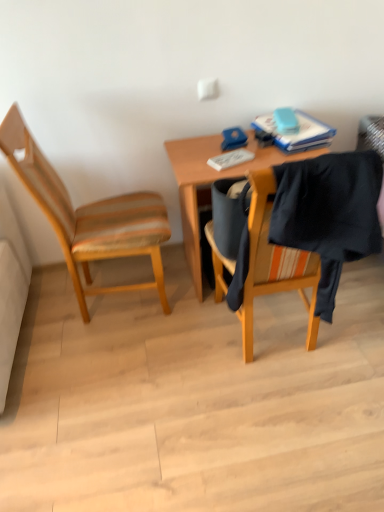
The height and width of the screenshot is (512, 384). What do you see at coordinates (211, 183) in the screenshot?
I see `wooden desk at center` at bounding box center [211, 183].

The height and width of the screenshot is (512, 384). In order to click on blue matte book at upper right in this screenshot , I will do `click(294, 134)`.

Where is `black fabric at right`? This screenshot has width=384, height=512. black fabric at right is located at coordinates (329, 214).

Find the location of a particular element. wooden desk at center is located at coordinates (211, 183).

Can you tell me how much blue matte book at upper right and wooden chair at left differ in facing direction?

The angular difference between blue matte book at upper right and wooden chair at left is 79.7 degrees.

In the scene shown: Can you confirm if blue matte book at upper right is shorter than wooden chair at left?

Yes, blue matte book at upper right is shorter than wooden chair at left.

Which is in front, blue matte book at upper right or wooden chair at left?

wooden chair at left.

Does blue matte book at upper right appear on the left side of wooden chair at left?

No, blue matte book at upper right is not to the left of wooden chair at left.

Where is `desk on the left of the black fabric at right`? This screenshot has width=384, height=512. desk on the left of the black fabric at right is located at coordinates (x=211, y=183).

Based on their positions, is black fabric at right located to the left or right of wooden desk at center?

Clearly, black fabric at right is on the right of wooden desk at center in the image.

Measure the distance from black fabric at right to wooden desk at center.

18.20 inches.

Based on the photo, does black fabric at right have a greater width compared to wooden desk at center?

Incorrect, the width of black fabric at right does not surpass that of wooden desk at center.

Is wooden desk at center facing towards blue matte book at upper right?

No, wooden desk at center does not turn towards blue matte book at upper right.

Considering the relative sizes of wooden desk at center and blue matte book at upper right in the image provided, is wooden desk at center taller than blue matte book at upper right?

Yes.

From the image's perspective, is wooden desk at center located above or below blue matte book at upper right?

From the image's perspective, wooden desk at center appears below blue matte book at upper right.

Consider the image. Who is more distant, wooden desk at center or black fabric at right?

wooden desk at center is behind.

How distant is wooden desk at center from black fabric at right?

wooden desk at center is 18.20 inches away from black fabric at right.

Which is nearer, (200, 187) or (269, 232)?

The point (269, 232) is closer.

Considering the sizes of objects wooden desk at center and black fabric at right in the image provided, who is shorter, wooden desk at center or black fabric at right?

Standing shorter between the two is black fabric at right.

From the image's perspective, which object appears higher, wooden chair at left or blue matte book at upper right?

blue matte book at upper right is shown above in the image.

Is point (102, 251) in front of point (270, 131)?

Yes, point (102, 251) is closer to viewer.

Considering the sizes of objects wooden chair at left and blue matte book at upper right in the image provided, who is shorter, wooden chair at left or blue matte book at upper right?

blue matte book at upper right.

Considering the positions of objects wooden chair at left and blue matte book at upper right in the image provided, who is more to the left, wooden chair at left or blue matte book at upper right?

From the viewer's perspective, wooden chair at left appears more on the left side.

Is blue matte book at upper right facing towards wooden desk at center?

No.

Is point (314, 126) positioned in front of point (185, 199)?

Yes, point (314, 126) is closer to viewer.

Is blue matte book at upper right positioned far away from wooden desk at center?

No, blue matte book at upper right is in close proximity to wooden desk at center.

Is there a large distance between black fabric at right and wooden chair at left?

That's not correct — black fabric at right is a little close to wooden chair at left.

Considering the points (337, 228) and (67, 236), which point is behind, point (337, 228) or point (67, 236)?

The point (67, 236) is behind.

Considering the positions of objects black fabric at right and wooden chair at left in the image provided, who is more to the right, black fabric at right or wooden chair at left?

From the viewer's perspective, black fabric at right appears more on the right side.

In terms of size, does black fabric at right appear bigger or smaller than wooden chair at left?

black fabric at right is smaller than wooden chair at left.

At what (x,y) coordinates should I click in order to perform the action: click on book on the right of wooden chair at left. Please return your answer as a coordinate pair (x, y). Looking at the image, I should click on (294, 134).

Where is `desk above the black fabric at right (from the image's perspective)`? The width and height of the screenshot is (384, 512). desk above the black fabric at right (from the image's perspective) is located at coordinates (211, 183).

Looking at the image, which one is located further to wooden chair at left, blue matte book at upper right or black fabric at right?

black fabric at right is positioned further to the anchor wooden chair at left.

When comparing their distances from wooden desk at center, does wooden chair at left or blue matte book at upper right seem further?

wooden chair at left is positioned further to the anchor wooden desk at center.

Based on their spatial positions, is wooden chair at left or black fabric at right further from blue matte book at upper right?

wooden chair at left is further to blue matte book at upper right.

Based on their spatial positions, is blue matte book at upper right or black fabric at right closer to wooden desk at center?

blue matte book at upper right lies closer to wooden desk at center than the other object.

In the scene shown: Estimate the real-world distances between objects in this image. Which object is further from wooden chair at left, wooden desk at center or black fabric at right?

black fabric at right lies further to wooden chair at left than the other object.

Based on their spatial positions, is blue matte book at upper right or wooden chair at left closer to wooden desk at center?

blue matte book at upper right lies closer to wooden desk at center than the other object.

Estimate the real-world distances between objects in this image. Which object is closer to blue matte book at upper right, wooden desk at center or wooden chair at left?

wooden desk at center.

Based on their spatial positions, is wooden desk at center or wooden chair at left closer to black fabric at right?

wooden desk at center is closer to black fabric at right.

Find the location of `desk between wooden chair at left and blue matte book at upper right in the horizontal direction`. desk between wooden chair at left and blue matte book at upper right in the horizontal direction is located at coordinates (211, 183).

Where is `clothe situated between wooden chair at left and blue matte book at upper right from left to right`? clothe situated between wooden chair at left and blue matte book at upper right from left to right is located at coordinates (329, 214).

You are a GUI agent. You are given a task and a screenshot of the screen. Output one action in this format:
    pyautogui.click(x=<x>, y=<y>)
    Task: Click on the desk between black fabric at right and blue matte book at upper right from front to back
    The image size is (384, 512).
    Given the screenshot: What is the action you would take?
    pyautogui.click(x=211, y=183)

Identify the location of desk between wooden chair at left and black fabric at right. (211, 183).